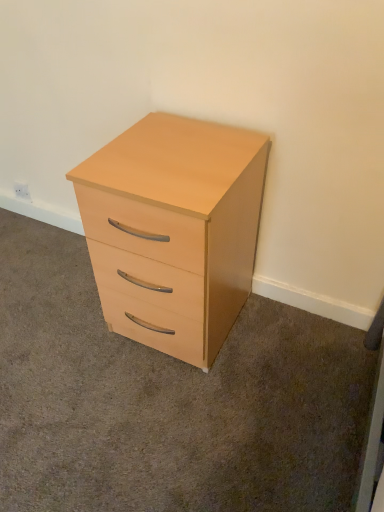
Locate an element on the screen. free space in front of light wood/finish chest of drawers at center is located at coordinates (172, 415).